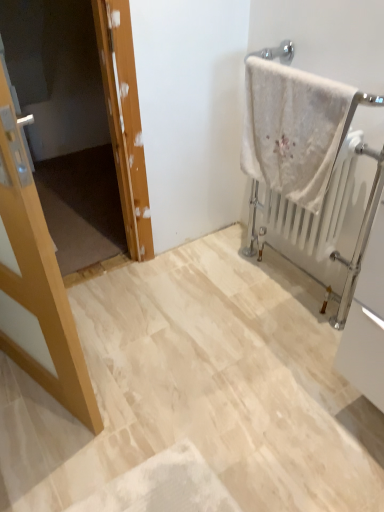
Where is `free space to the right of wooden door at left`? This screenshot has height=512, width=384. free space to the right of wooden door at left is located at coordinates (155, 280).